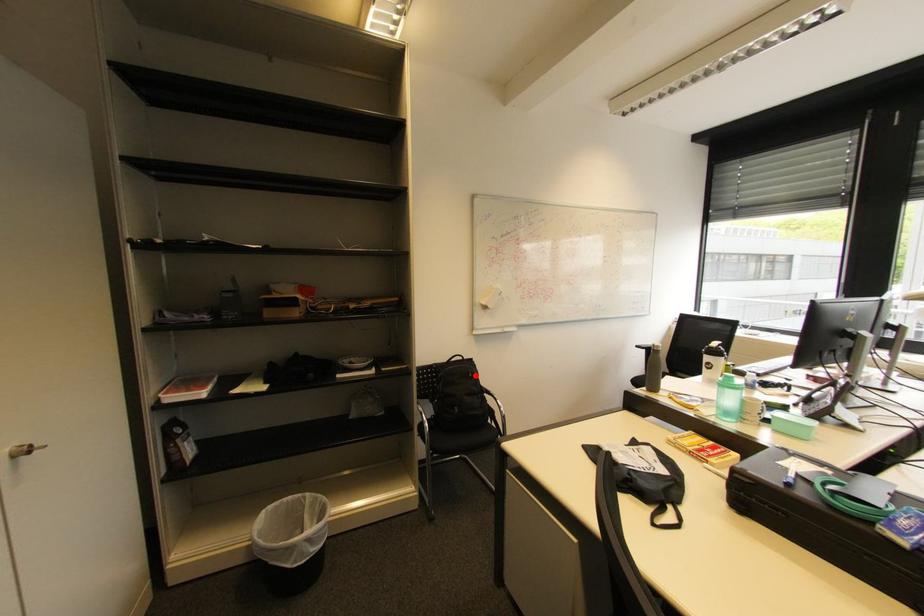
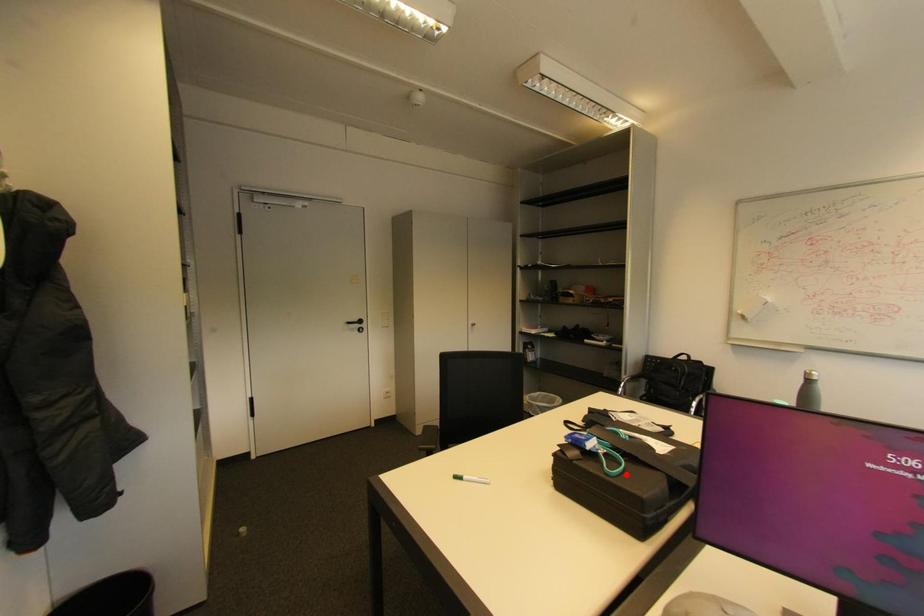
I am providing you with two images of the same scene from different viewpoints. A red point is marked on the first image and another point is marked on the second image. Is the marked point in image1 the same physical position as the marked point in image2?

No